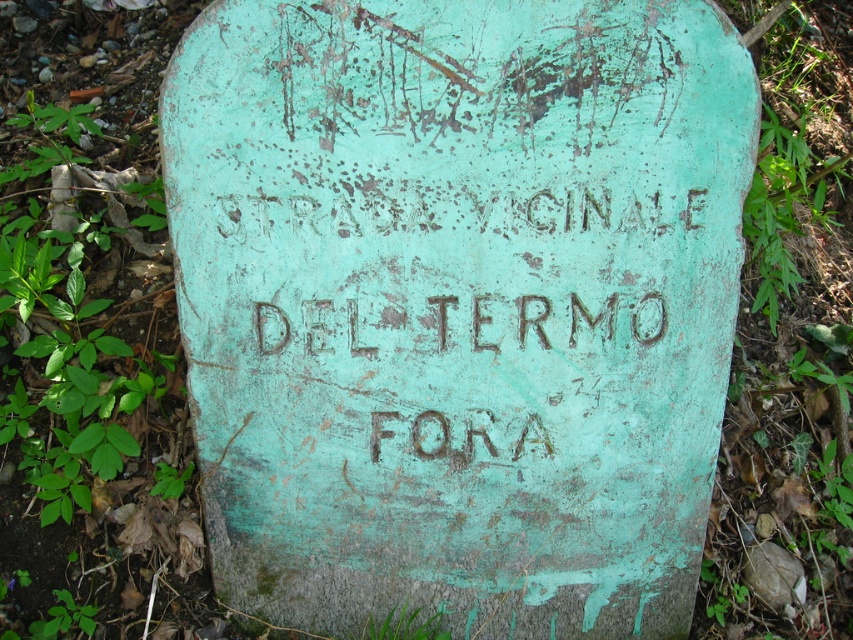
Does green patina stone sign at center appear on the left side of green patina stone at lower right?

Correct, you'll find green patina stone sign at center to the left of green patina stone at lower right.

Between point (440, 392) and point (804, 602), which one is positioned behind?

The point (804, 602) is more distant.

Is point (712, 157) less distant than point (759, 572)?

Yes, point (712, 157) is in front of point (759, 572).

Find the location of a particular element. green patina stone sign at center is located at coordinates (457, 305).